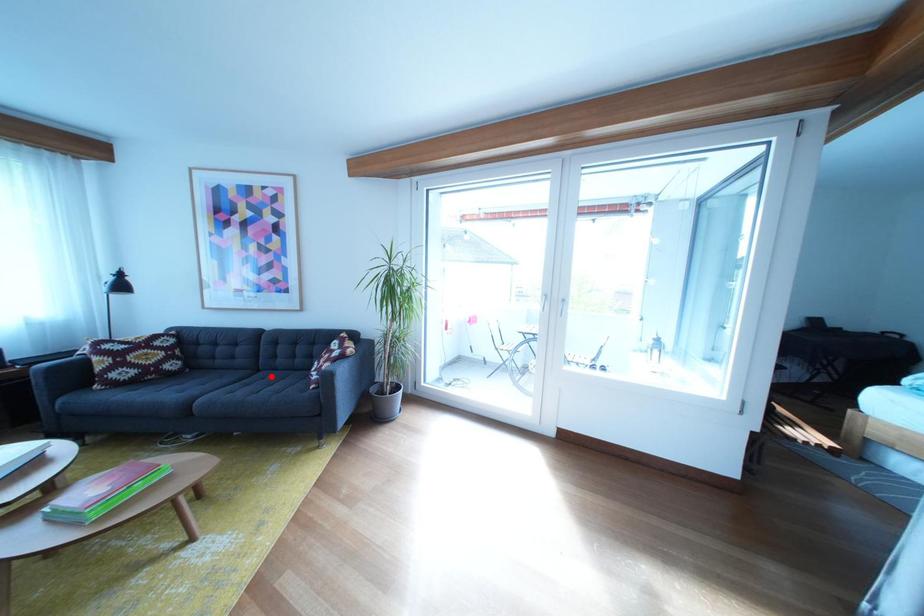
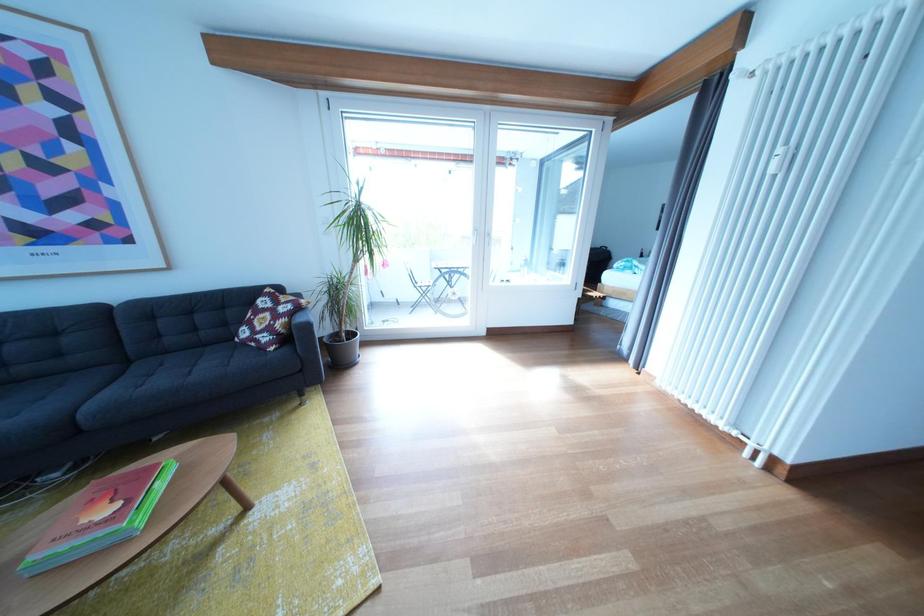
Question: I am providing you with two images of the same scene from different viewpoints. In image1, a red point is highlighted. Considering the same 3D point in image2, which of the following is correct?

Choices:
 (A) It is closer
 (B) It is farther

Answer: (A)